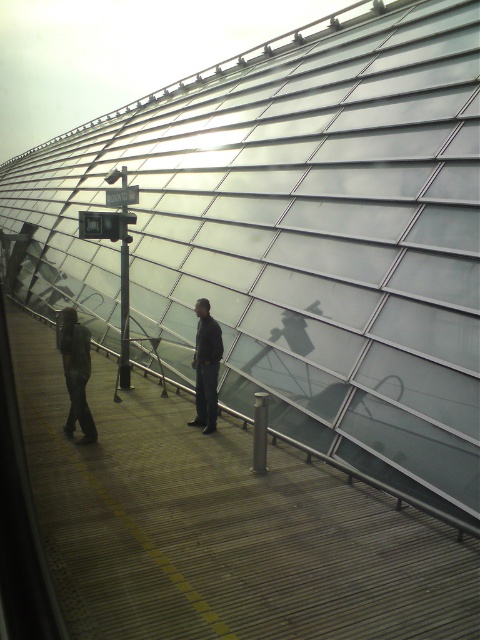
Is dark gray jeans at left shorter than dark gray jacket at center?

Yes, dark gray jeans at left is shorter than dark gray jacket at center.

Who is more forward, (84, 384) or (206, 301)?

Point (84, 384) is in front.

Locate an element on the screen. Image resolution: width=480 pixels, height=640 pixels. dark gray jeans at left is located at coordinates [x=76, y=372].

Can you confirm if wooden walkway at center is shorter than dark gray jacket at center?

Correct, wooden walkway at center is not as tall as dark gray jacket at center.

Is wooden walkway at center smaller than dark gray jacket at center?

Incorrect, wooden walkway at center is not smaller in size than dark gray jacket at center.

Who is more distant from viewer, (x=155, y=417) or (x=212, y=362)?

The point (x=155, y=417) is more distant.

Find the location of a particular element. The width and height of the screenshot is (480, 640). wooden walkway at center is located at coordinates (220, 525).

Measure the distance between point (316, 547) and camera.

Point (316, 547) and camera are 16.59 feet apart from each other.

Does wooden walkway at center have a lesser width compared to dark gray jeans at left?

No, wooden walkway at center is not thinner than dark gray jeans at left.

Between point (132, 634) and point (71, 433), which one is positioned in front?

Point (132, 634) is more forward.

This screenshot has height=640, width=480. Find the location of `wooden walkway at center`. wooden walkway at center is located at coordinates (220, 525).